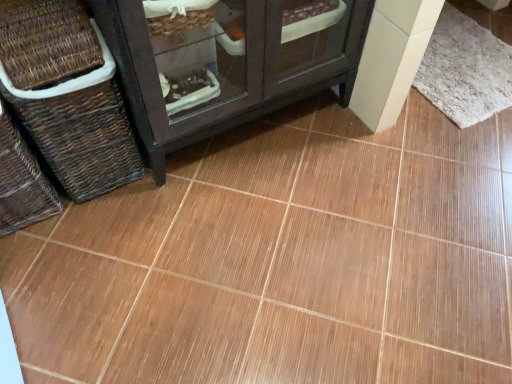
Image resolution: width=512 pixels, height=384 pixels. I want to click on free space to the right of brown woven basket at left, acting as the 2th basket starting from the left, so click(186, 181).